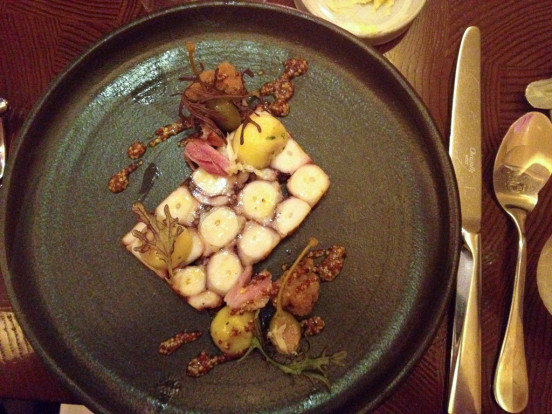
Locate an element on the screen. This screenshot has height=414, width=552. black pan is located at coordinates (357, 213).